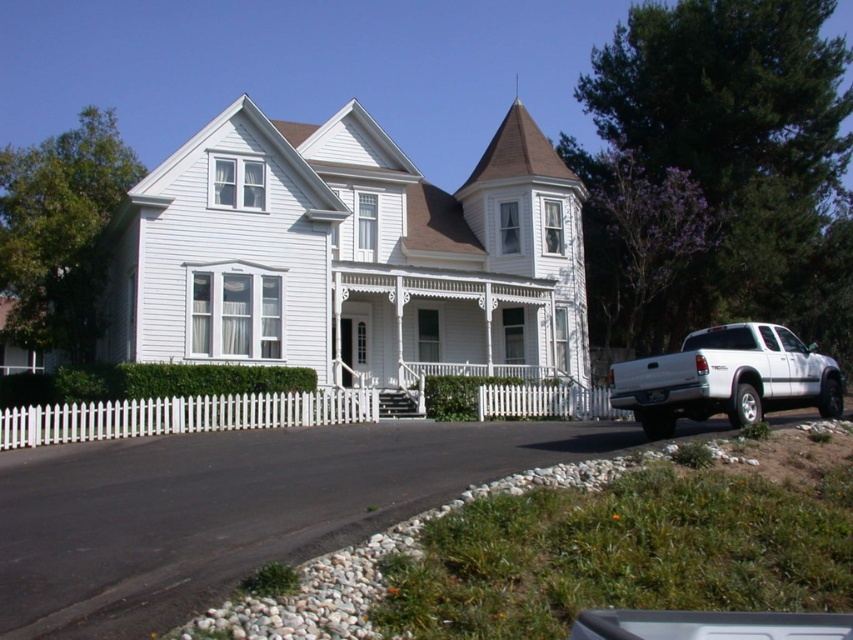
Question: Is the position of white matte truck at lower right less distant than that of white picket fence at center?

Choices:
 (A) no
 (B) yes

Answer: (B)

Question: Does white matte truck at lower right have a smaller size compared to white picket fence at center?

Choices:
 (A) yes
 (B) no

Answer: (B)

Question: Observing the image, what is the correct spatial positioning of white matte truck at lower right in reference to white picket fence at center?

Choices:
 (A) right
 (B) left

Answer: (A)

Question: Which of the following is the farthest from the observer?

Choices:
 (A) (195, 424)
 (B) (666, 385)

Answer: (A)

Question: Which object is farther from the camera taking this photo?

Choices:
 (A) white picket fence at center
 (B) white matte truck at lower right

Answer: (A)